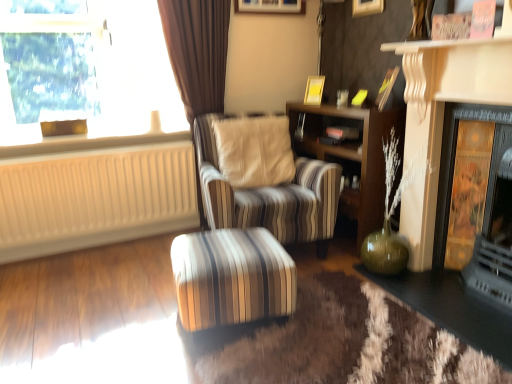
Question: Could you tell me if beige ribbed radiator at left is facing gold textured panel at right?

Choices:
 (A) yes
 (B) no

Answer: (B)

Question: Is beige ribbed radiator at left positioned in front of gold textured panel at right?

Choices:
 (A) no
 (B) yes

Answer: (A)

Question: Is beige ribbed radiator at left smaller than gold textured panel at right?

Choices:
 (A) yes
 (B) no

Answer: (A)

Question: Does beige ribbed radiator at left appear on the right side of gold textured panel at right?

Choices:
 (A) yes
 (B) no

Answer: (B)

Question: From a real-world perspective, does beige ribbed radiator at left sit lower than gold textured panel at right?

Choices:
 (A) no
 (B) yes

Answer: (B)

Question: Considering the positions of green glass vase at lower right, which ranks as the first table in right-to-left order, and wooden bookshelf at center in the image, is green glass vase at lower right, which ranks as the first table in right-to-left order, taller or shorter than wooden bookshelf at center?

Choices:
 (A) short
 (B) tall

Answer: (A)

Question: From the image's perspective, is green glass vase at lower right, the 2th table from the left, positioned above or below wooden bookshelf at center?

Choices:
 (A) above
 (B) below

Answer: (B)

Question: Based on their sizes in the image, would you say green glass vase at lower right, which ranks as the first table in right-to-left order, is bigger or smaller than wooden bookshelf at center?

Choices:
 (A) big
 (B) small

Answer: (B)

Question: Do you think green glass vase at lower right, the 2th table from the left, is within wooden bookshelf at center, or outside of it?

Choices:
 (A) outside
 (B) inside

Answer: (A)

Question: Does point tap(129, 28) appear closer or farther from the camera than point tap(202, 127)?

Choices:
 (A) closer
 (B) farther

Answer: (B)

Question: Choose the correct answer: Is transparent glass window at upper left inside striped fabric chair at center or outside it?

Choices:
 (A) inside
 (B) outside

Answer: (B)

Question: Is transparent glass window at upper left taller or shorter than striped fabric chair at center?

Choices:
 (A) tall
 (B) short

Answer: (B)

Question: From a real-world perspective, is transparent glass window at upper left positioned above or below striped fabric chair at center?

Choices:
 (A) below
 (B) above

Answer: (B)

Question: Considering their positions, is wooden picture frame at upper center, acting as the second picture frame starting from the top, located in front of or behind beige ribbed radiator at left?

Choices:
 (A) behind
 (B) front

Answer: (A)

Question: Which is correct: wooden picture frame at upper center, which is counted as the 2th picture frame, starting from the bottom, is inside beige ribbed radiator at left, or outside of it?

Choices:
 (A) inside
 (B) outside

Answer: (B)